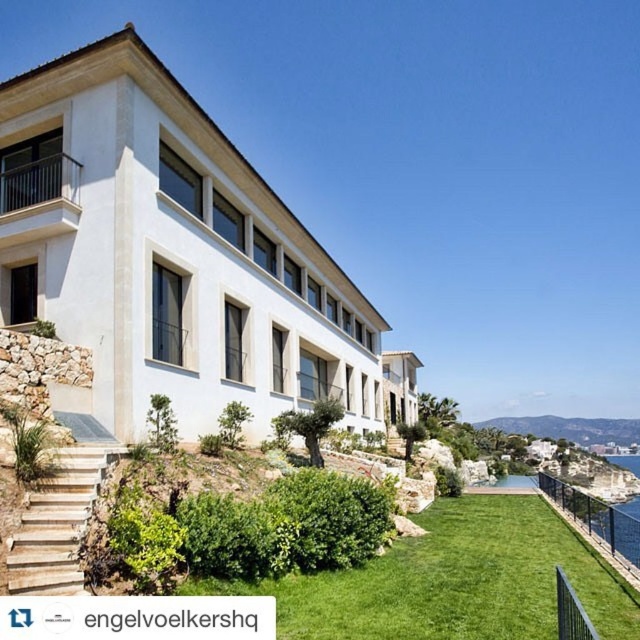
Question: Among these points, which one is nearest to the camera?

Choices:
 (A) (406, 608)
 (B) (60, 532)

Answer: (B)

Question: Can you confirm if white smooth villa at center is positioned above natural stone stairs at lower left?

Choices:
 (A) yes
 (B) no

Answer: (B)

Question: Does white smooth villa at center appear on the left side of green grass at lower center?

Choices:
 (A) no
 (B) yes

Answer: (B)

Question: Does green grass at lower center lie in front of natural stone stairs at lower left?

Choices:
 (A) no
 (B) yes

Answer: (A)

Question: Among these objects, which one is nearest to the camera?

Choices:
 (A) white smooth villa at center
 (B) natural stone stairs at lower left
 (C) green grass at lower center

Answer: (B)

Question: Among these points, which one is nearest to the camera?

Choices:
 (A) (88, 509)
 (B) (241, 316)
 (C) (428, 563)

Answer: (A)